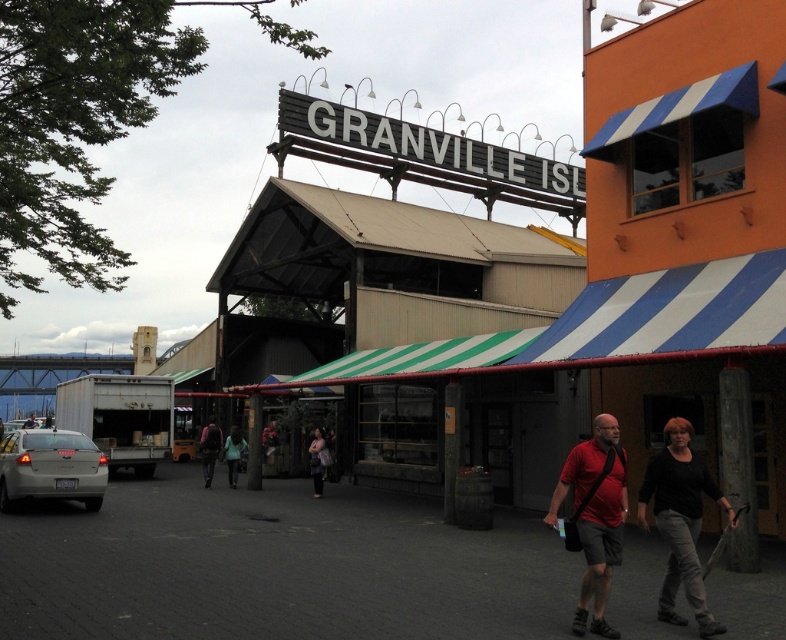
You are a photographer standing at the entrance of Granville Island. You notice a black cotton shirt at center and a satin silver sedan at lower left. Which object is closer to you?

The black cotton shirt at center is closer to you because it is in front of the satin silver sedan at lower left.

You are a delivery person with a cart that can only move 10 meters. You need to deliver a package from the black cotton shirt at center to the satin silver sedan at lower left. Can you reach the sedan without exceeding your cart range?

The distance between the black cotton shirt at center and the satin silver sedan at lower left is 12.45 meters, which exceeds the cart range of 10 meters. Therefore, you cannot reach the sedan without exceeding the cart range.